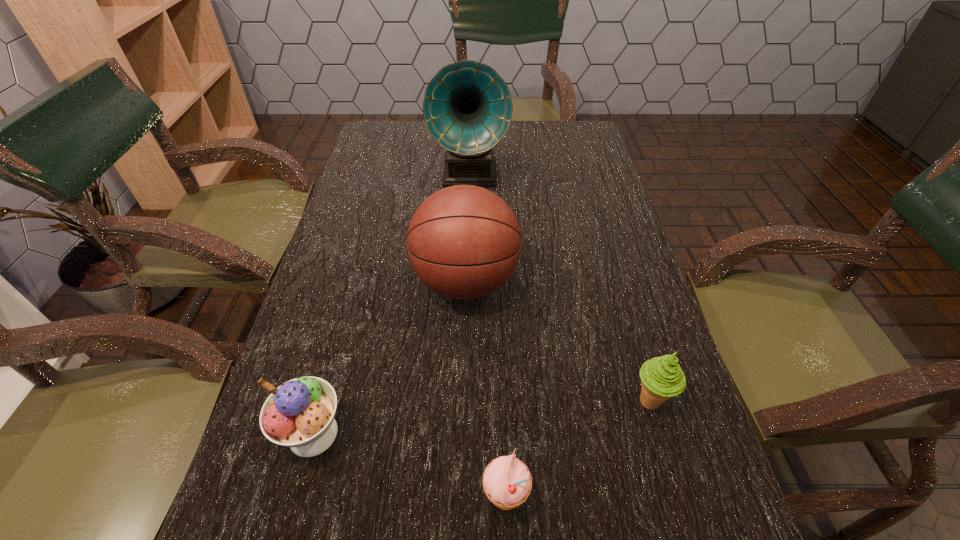
At what (x,y) coordinates should I click in order to perform the action: click on free location located on the front of the rightmost icecream. Please return your answer as a coordinate pair (x, y). The image size is (960, 540). Looking at the image, I should click on (670, 472).

Identify the location of free space located 0.050m on the back of the leftmost object. [328, 379].

This screenshot has height=540, width=960. In order to click on free spot located on the right of the nearest icecream in this screenshot , I will do `click(681, 500)`.

This screenshot has width=960, height=540. I want to click on object that is at the far edge, so click(x=467, y=107).

I want to click on object located at the left edge, so [299, 414].

The image size is (960, 540). In order to click on object situated at the right edge in this screenshot , I will do `click(661, 377)`.

The image size is (960, 540). In the image, there is a desktop. Identify the location of free space at the far edge. (423, 143).

In the image, there is a desktop. Where is `free space at the left edge`? free space at the left edge is located at coordinates (307, 331).

This screenshot has height=540, width=960. Find the location of `blank space at the right edge`. blank space at the right edge is located at coordinates (572, 157).

What are the coordinates of `vacant space at the far right corner of the desktop` in the screenshot? It's located at (588, 144).